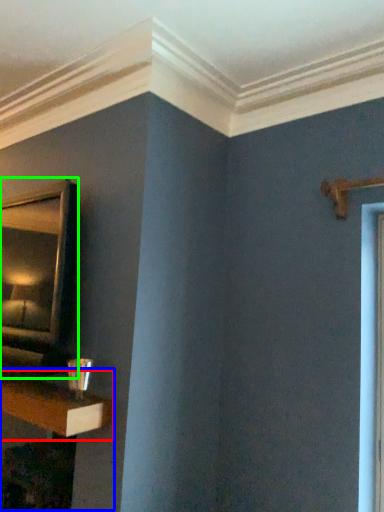
Question: Based on their relative distances, which object is nearer to shelf (highlighted by a red box)? Choose from table (highlighted by a blue box) and mirror (highlighted by a green box).

Choices:
 (A) table
 (B) mirror

Answer: (A)